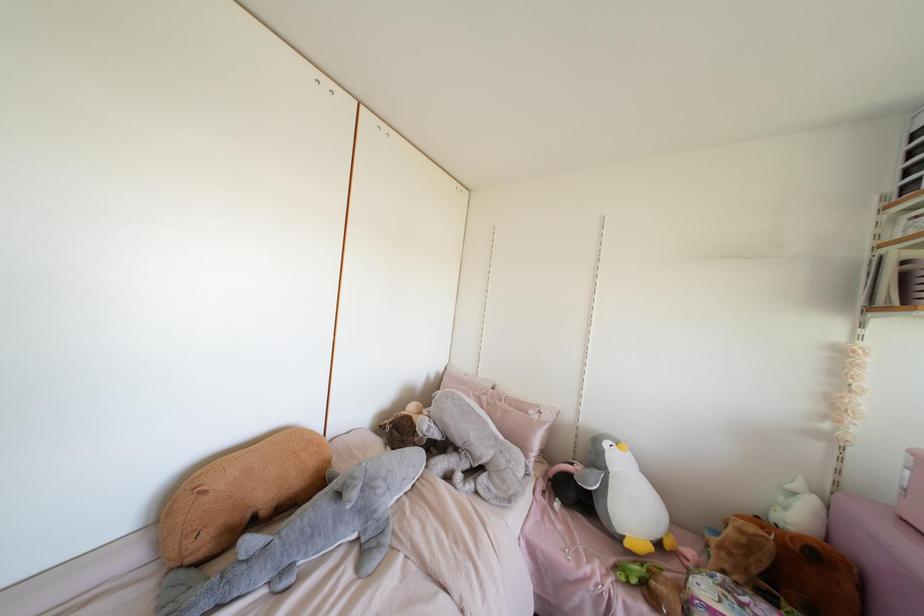
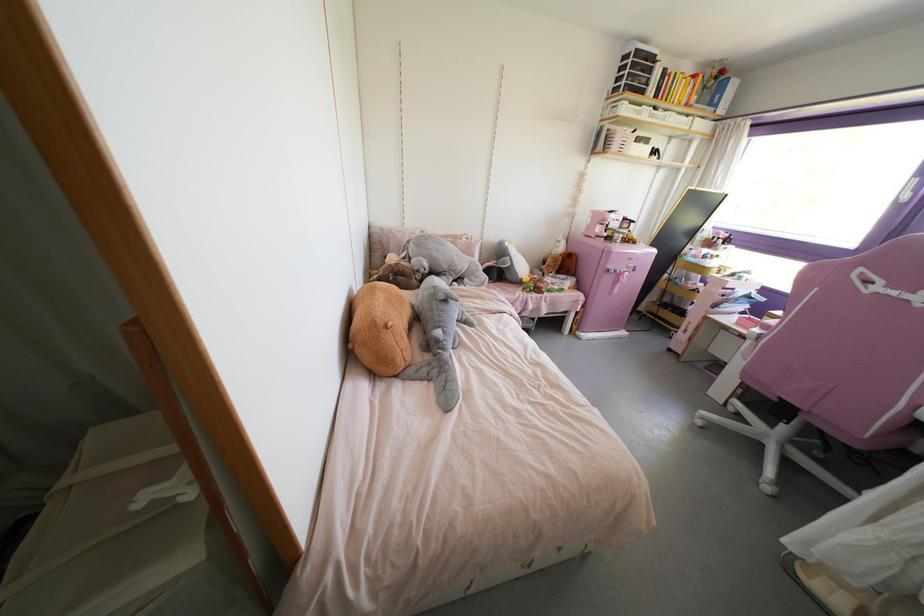
In the second image, find the point that corresponds to [626,544] in the first image.

(523, 280)